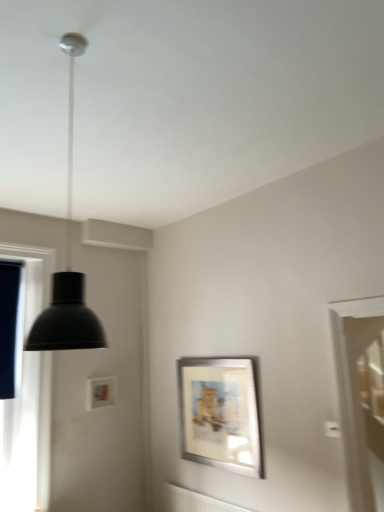
Question: Is matte black pendant light at upper left positioned behind silver metallic picture frame at center?

Choices:
 (A) no
 (B) yes

Answer: (A)

Question: Is matte black pendant light at upper left thinner than silver metallic picture frame at center?

Choices:
 (A) yes
 (B) no

Answer: (B)

Question: Is matte black pendant light at upper left directly adjacent to silver metallic picture frame at center?

Choices:
 (A) yes
 (B) no

Answer: (B)

Question: Is matte black pendant light at upper left at the left side of silver metallic picture frame at center?

Choices:
 (A) no
 (B) yes

Answer: (B)

Question: Considering the relative sizes of matte black pendant light at upper left and silver metallic picture frame at center in the image provided, is matte black pendant light at upper left shorter than silver metallic picture frame at center?

Choices:
 (A) no
 (B) yes

Answer: (A)

Question: From a real-world perspective, is white glossy screen door at right physically located above or below silver metallic picture frame at center?

Choices:
 (A) above
 (B) below

Answer: (A)

Question: Is white glossy screen door at right wider or thinner than silver metallic picture frame at center?

Choices:
 (A) wide
 (B) thin

Answer: (A)

Question: Is white glossy screen door at right in front of or behind silver metallic picture frame at center in the image?

Choices:
 (A) front
 (B) behind

Answer: (B)

Question: Does point (360, 331) appear closer or farther from the camera than point (238, 460)?

Choices:
 (A) farther
 (B) closer

Answer: (A)

Question: From the image's perspective, is matte black pendant light at upper left located above or below silver metallic picture frame at center?

Choices:
 (A) above
 (B) below

Answer: (A)

Question: Is matte black pendant light at upper left inside or outside of silver metallic picture frame at center?

Choices:
 (A) inside
 (B) outside

Answer: (B)

Question: Does point (61, 274) appear closer or farther from the camera than point (213, 408)?

Choices:
 (A) farther
 (B) closer

Answer: (B)

Question: Considering the positions of matte black pendant light at upper left and silver metallic picture frame at center in the image, is matte black pendant light at upper left taller or shorter than silver metallic picture frame at center?

Choices:
 (A) tall
 (B) short

Answer: (A)

Question: Would you say white glossy screen door at right is inside or outside matte black pendant light at upper left?

Choices:
 (A) inside
 (B) outside

Answer: (B)

Question: Considering the positions of white glossy screen door at right and matte black pendant light at upper left in the image, is white glossy screen door at right bigger or smaller than matte black pendant light at upper left?

Choices:
 (A) big
 (B) small

Answer: (A)